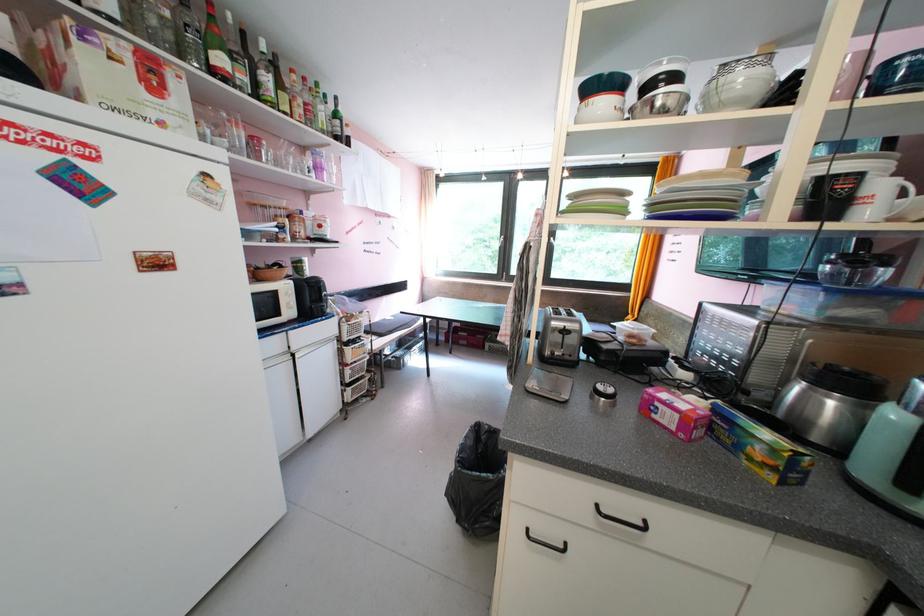
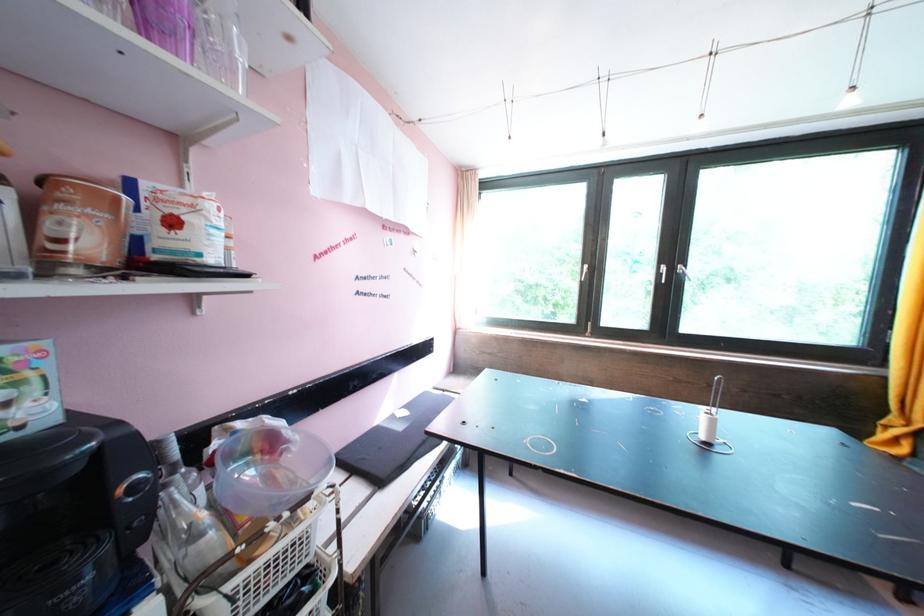
Locate, in the second image, the point that corresponds to the point at 329,228 in the first image.

(181, 225)